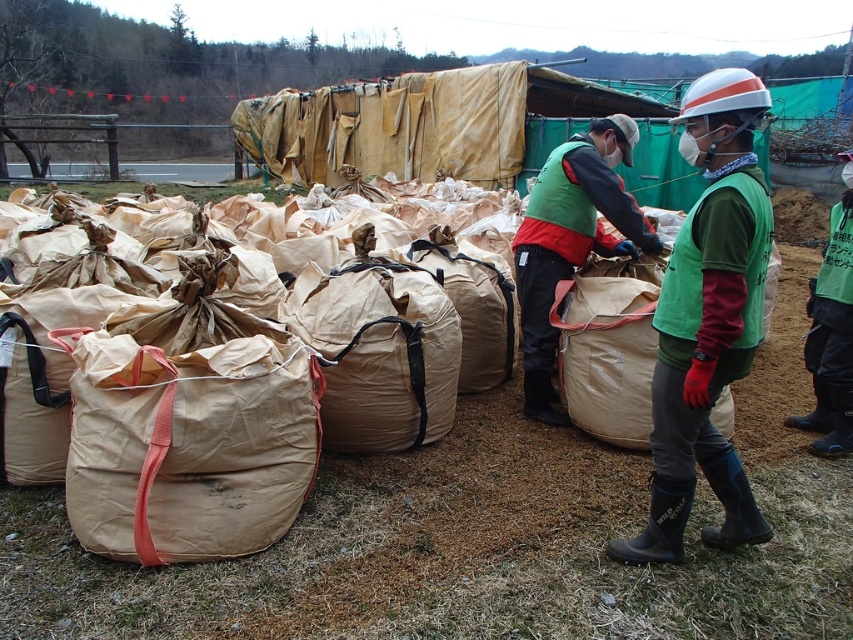
You are an observer standing in the middle of the outdoor scene. You notice the green fabric vest at center and the beige paper sack at center. Which object takes up more space in your field of view?

The green fabric vest at center is larger in size than the beige paper sack at center, so it takes up more space in your field of view.

Where is the brown paper bag at center located in the image?

The brown paper bag at center is located at point 0.644 on the x axis and 0.279 on the y axis.

You are organizing supplies for a community cleanup event. You have a brown paper bag at center and a brown paper sack at center. Which one can hold more items based on their size?

The brown paper bag at center has a larger size compared to the brown paper sack at center, so it can hold more items.